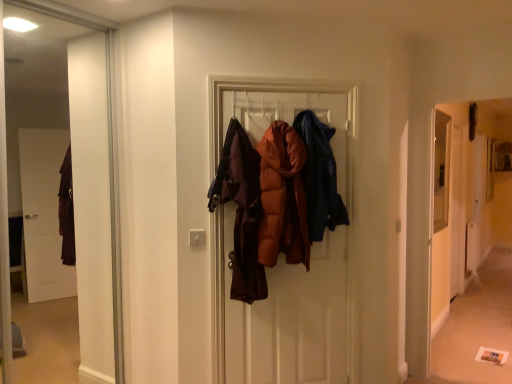
Question: Is point (339, 220) closer or farther from the camera than point (439, 274)?

Choices:
 (A) closer
 (B) farther

Answer: (A)

Question: In the image, is dark blue denim jacket at center, placed as the 2th garment when sorted from left to right, positioned in front of or behind carpeted floor at lower right?

Choices:
 (A) front
 (B) behind

Answer: (A)

Question: Which object is the closest to the matte brown puffer jacket at center, the 1th garment positioned from the left?

Choices:
 (A) dark blue denim jacket at center, placed as the 2th garment when sorted from left to right
 (B) carpeted floor at lower right
 (C) transparent glass screen door at right

Answer: (A)

Question: Estimate the real-world distances between objects in this image. Which object is farther from the transparent glass screen door at right?

Choices:
 (A) dark blue denim jacket at center, the first garment when ordered from right to left
 (B) matte brown puffer jacket at center, the 1th garment positioned from the left
 (C) carpeted floor at lower right

Answer: (B)